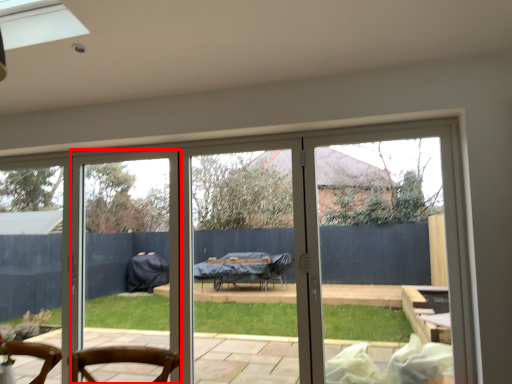
Question: Considering the relative positions of screen door (annotated by the red box) and door in the image provided, where is screen door (annotated by the red box) located with respect to the staircase?

Choices:
 (A) left
 (B) right

Answer: (A)